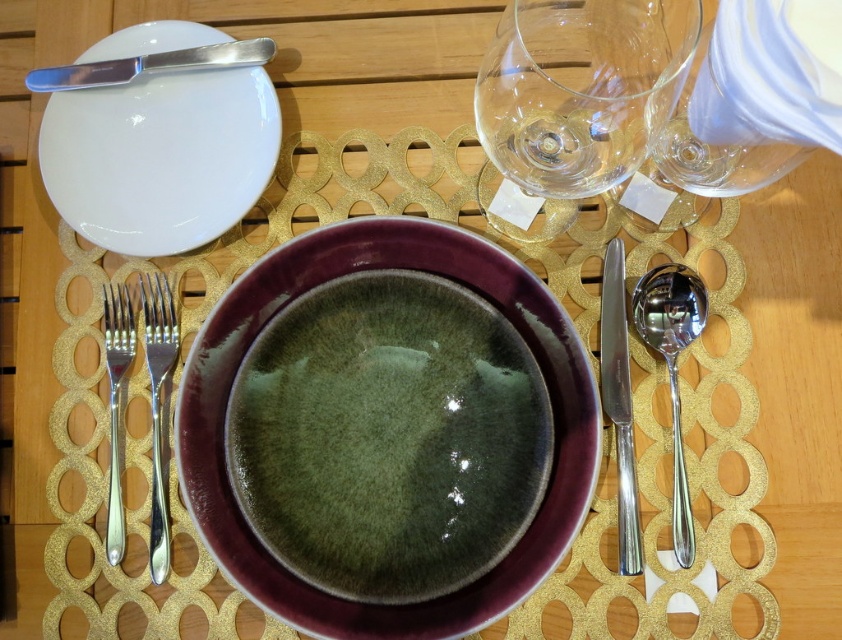
Is white glossy plate at upper left to the left of transparent glass wine glass at upper right from the viewer's perspective?

Yes, white glossy plate at upper left is to the left of transparent glass wine glass at upper right.

Who is higher up, white glossy plate at upper left or transparent glass wine glass at upper right?

transparent glass wine glass at upper right is above.

Who is more forward, (116, 237) or (576, 33)?

Point (576, 33) is more forward.

Identify the location of white glossy plate at upper left. This screenshot has width=842, height=640. (161, 140).

Between transparent glass wine glass at upper right and satin silver fork at left, which one has less height?

transparent glass wine glass at upper right

How much distance is there between transparent glass wine glass at upper right and satin silver fork at left?

transparent glass wine glass at upper right and satin silver fork at left are 6.49 inches apart from each other.

Is point (622, 145) less distant than point (156, 440)?

Yes, point (622, 145) is in front of point (156, 440).

You are a GUI agent. You are given a task and a screenshot of the screen. Output one action in this format:
    pyautogui.click(x=<x>, y=<y>)
    Task: Click on the transparent glass wine glass at upper right
    This screenshot has width=842, height=640.
    Given the screenshot: What is the action you would take?
    pyautogui.click(x=581, y=88)

Does green glossy bowl at center have a smaller size compared to polished metal butter knife at upper left?

Actually, green glossy bowl at center might be larger than polished metal butter knife at upper left.

Looking at this image, between green glossy bowl at center and polished metal butter knife at upper left, which one has more height?

green glossy bowl at center is taller.

At what (x,y) coordinates should I click in order to perform the action: click on green glossy bowl at center. Please return your answer as a coordinate pair (x, y). This screenshot has height=640, width=842. Looking at the image, I should click on (320, 284).